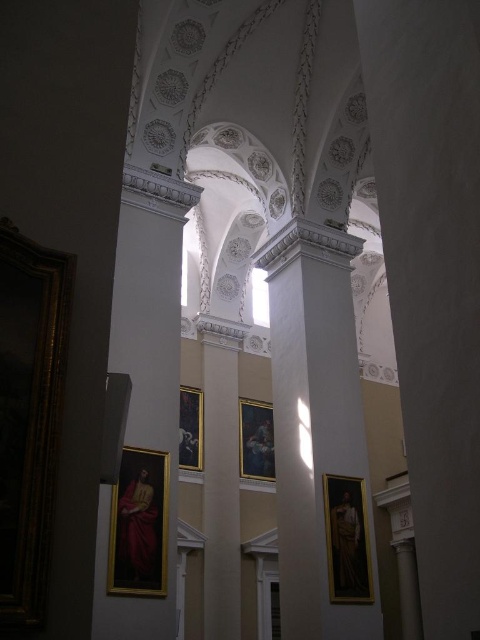
You are an architect examining the interior of a grand building. You notice the white glossy column at center and the gold ornate picture frame at left. Which object is positioned higher in the image?

The gold ornate picture frame at left is positioned higher than the white glossy column at center because the white glossy column at center is located below it.

You are standing inside the grand building and looking up at the ceiling. There are two points marked on the ceiling, point (129,582) and point (245,474). Which point is closer to your eyes?

Point (129,582) is closer to the viewer than point (245,474).